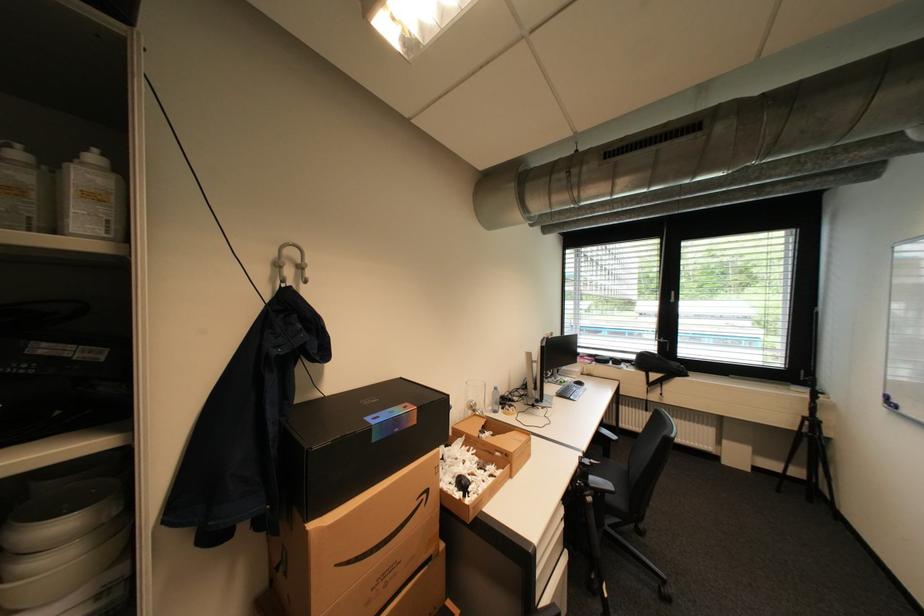
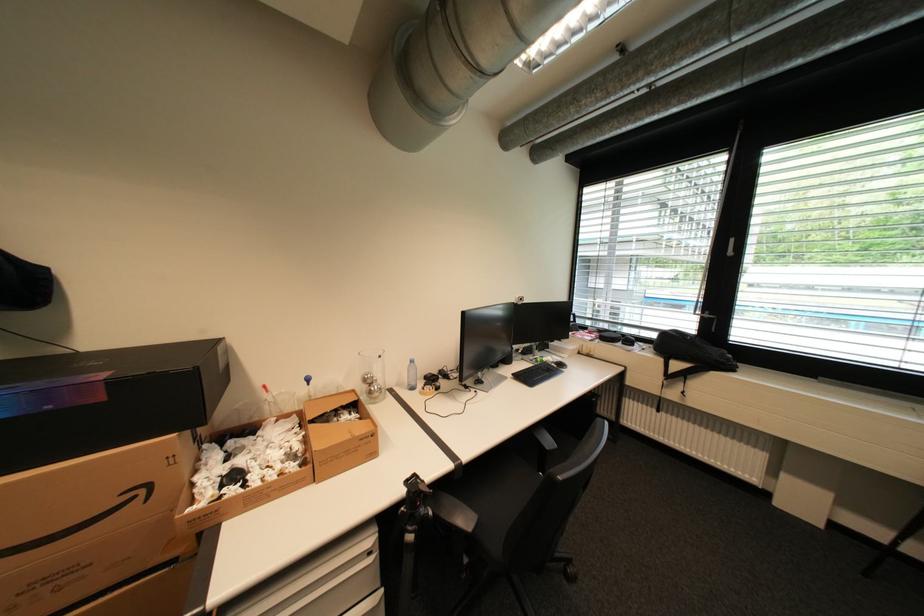
Where in the second image is the point corresponding to [433,496] from the first image?

(151, 491)